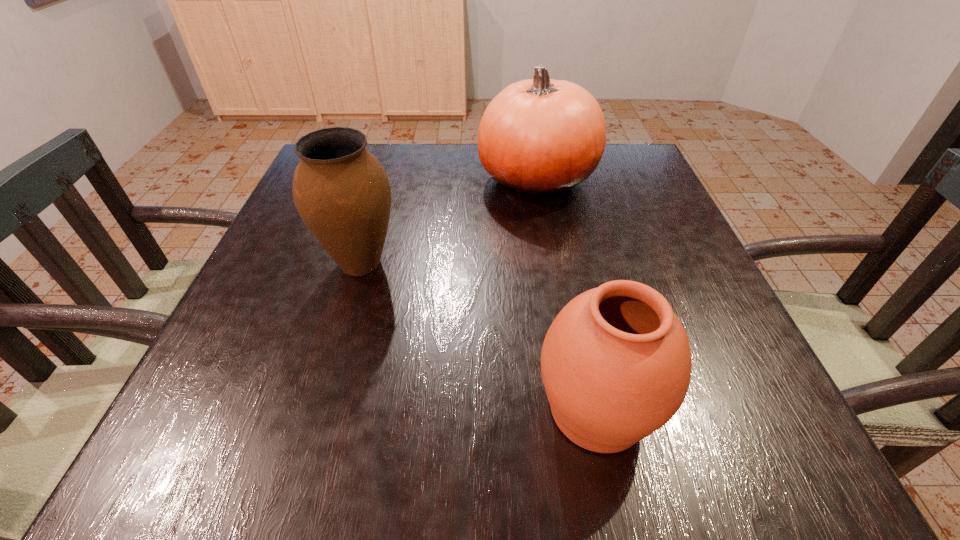
This screenshot has width=960, height=540. What are the coordinates of `object located at the left edge` in the screenshot? It's located at (341, 191).

You are a GUI agent. You are given a task and a screenshot of the screen. Output one action in this format:
    pyautogui.click(x=<x>, y=<y>)
    Task: Click on the object present at the right edge
    The height and width of the screenshot is (540, 960).
    Given the screenshot: What is the action you would take?
    pyautogui.click(x=540, y=137)

The height and width of the screenshot is (540, 960). What are the coordinates of `object situated at the far right corner` in the screenshot? It's located at (540, 137).

You are a GUI agent. You are given a task and a screenshot of the screen. Output one action in this format:
    pyautogui.click(x=<x>, y=<y>)
    Task: Click on the vacant space at the far edge
    The width and height of the screenshot is (960, 540).
    Given the screenshot: What is the action you would take?
    pyautogui.click(x=450, y=149)

The image size is (960, 540). I want to click on vacant space at the near edge, so click(x=498, y=440).

In the image, there is a desktop. Where is `vacant space at the left edge`? The width and height of the screenshot is (960, 540). vacant space at the left edge is located at coordinates (298, 261).

The image size is (960, 540). Identify the location of free space at the right edge. (714, 338).

Where is `blank space at the far right corner`? The width and height of the screenshot is (960, 540). blank space at the far right corner is located at coordinates (624, 180).

At what (x,y) coordinates should I click in order to perform the action: click on free space between the farthest object and the farther urn. Please return your answer as a coordinate pair (x, y). The image size is (960, 540). Looking at the image, I should click on (448, 221).

Where is `vacant area that lies between the shorter urn and the leftmost object`? This screenshot has height=540, width=960. vacant area that lies between the shorter urn and the leftmost object is located at coordinates (479, 336).